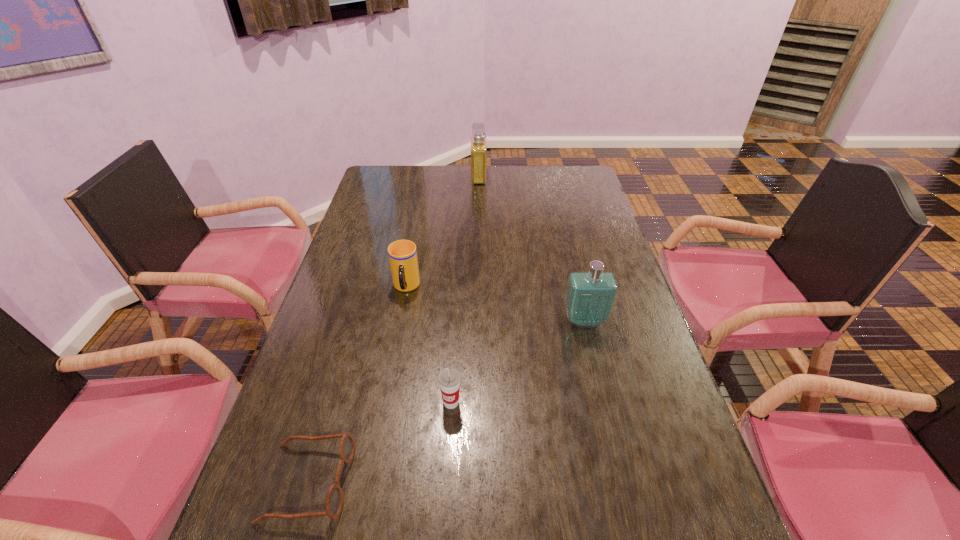
In order to click on unoccupied position between the nearest object and the left perfume in this screenshot , I will do `click(394, 329)`.

You are a GUI agent. You are given a task and a screenshot of the screen. Output one action in this format:
    pyautogui.click(x=<x>, y=<y>)
    Task: Click on the object that ranks as the fourth closest to the left perfume
    The height and width of the screenshot is (540, 960).
    Given the screenshot: What is the action you would take?
    pyautogui.click(x=334, y=503)

Locate an element on the screen. The height and width of the screenshot is (540, 960). object that is the closest to the rightmost object is located at coordinates 449,378.

This screenshot has width=960, height=540. In order to click on vacant space that satisfies the following two spatial constraints: 1. on the side of the nearer cup with the logo; 2. on the front-facing side of the spectacles in this screenshot , I will do `click(446, 482)`.

At what (x,y) coordinates should I click in order to perform the action: click on free space that satisfies the following two spatial constraints: 1. on the side of the farther cup with the handle; 2. on the front-facing side of the leftmost object. Please return your answer as a coordinate pair (x, y). Looking at the image, I should click on (370, 482).

Locate an element on the screen. free space that satisfies the following two spatial constraints: 1. on the side of the farther cup with the handle; 2. on the front-facing side of the shortest object is located at coordinates (370, 482).

The height and width of the screenshot is (540, 960). I want to click on free space in the image that satisfies the following two spatial constraints: 1. on the front-facing side of the left perfume; 2. on the side of the second object from left to right with the handle, so click(x=478, y=287).

The width and height of the screenshot is (960, 540). I want to click on vacant space that satisfies the following two spatial constraints: 1. on the front-facing side of the left perfume; 2. on the side of the right cup with the logo, so click(x=478, y=402).

This screenshot has height=540, width=960. Find the location of `blank space that satisfies the following two spatial constraints: 1. on the front-facing side of the farthest object; 2. on the side of the right cup with the logo`. blank space that satisfies the following two spatial constraints: 1. on the front-facing side of the farthest object; 2. on the side of the right cup with the logo is located at coordinates (478, 402).